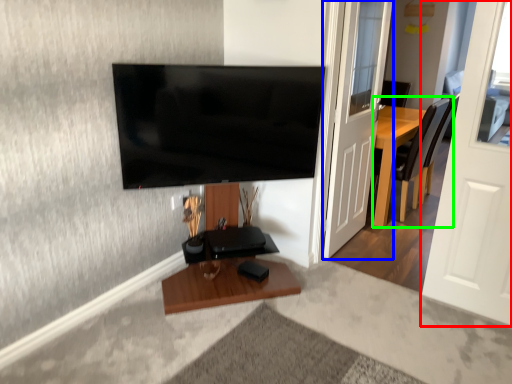
Question: Estimate the real-world distances between objects in this image. Which object is closer to door (highlighted by a red box), door (highlighted by a blue box) or chair (highlighted by a green box)?

Choices:
 (A) door
 (B) chair

Answer: (A)